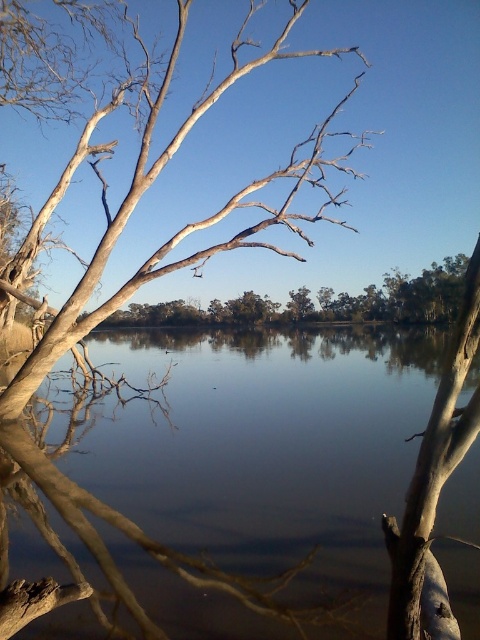
Question: Is smooth water at center positioned behind white textured bark at upper right?

Choices:
 (A) yes
 (B) no

Answer: (A)

Question: In this image, where is smooth water at center located relative to white textured bark at upper right?

Choices:
 (A) above
 (B) below

Answer: (B)

Question: Is smooth water at center positioned behind white textured bark at upper right?

Choices:
 (A) no
 (B) yes

Answer: (B)